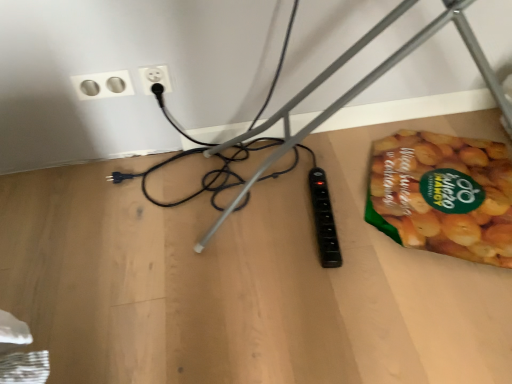
The width and height of the screenshot is (512, 384). I want to click on free area in between green matte snack packet at lower right and black plastic wire at lower right, so point(327,157).